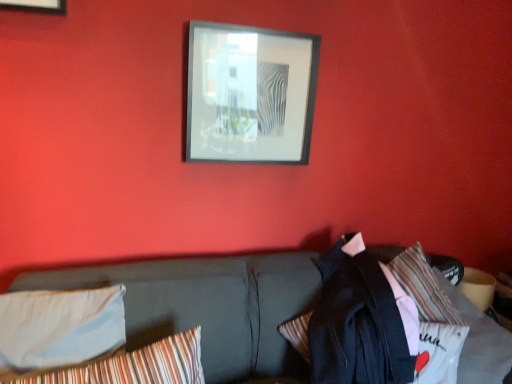
Question: From the image's perspective, would you say striped fabric pillow at lower left, placed as the second pillow when sorted from left to right, is shown under dark gray fabric couch at center?

Choices:
 (A) yes
 (B) no

Answer: (B)

Question: Is striped fabric pillow at lower left, placed as the second pillow when sorted from left to right, to the left of dark gray fabric couch at center from the viewer's perspective?

Choices:
 (A) no
 (B) yes

Answer: (B)

Question: From a real-world perspective, is striped fabric pillow at lower left, placed as the second pillow when sorted from left to right, over dark gray fabric couch at center?

Choices:
 (A) no
 (B) yes

Answer: (B)

Question: Are striped fabric pillow at lower left, placed as the second pillow when sorted from left to right, and dark gray fabric couch at center making contact?

Choices:
 (A) yes
 (B) no

Answer: (B)

Question: Does striped fabric pillow at lower left, the 1th pillow positioned from the right, have a greater height compared to dark gray fabric couch at center?

Choices:
 (A) yes
 (B) no

Answer: (B)

Question: Is dark gray fabric couch at center inside striped fabric pillow at lower left, placed as the second pillow when sorted from left to right?

Choices:
 (A) yes
 (B) no

Answer: (B)

Question: Considering the relative sizes of dark blue fabric jacket at lower right and dark gray fabric couch at center in the image provided, is dark blue fabric jacket at lower right shorter than dark gray fabric couch at center?

Choices:
 (A) yes
 (B) no

Answer: (A)

Question: Does dark blue fabric jacket at lower right have a larger size compared to dark gray fabric couch at center?

Choices:
 (A) yes
 (B) no

Answer: (B)

Question: Does dark blue fabric jacket at lower right appear on the left side of dark gray fabric couch at center?

Choices:
 (A) no
 (B) yes

Answer: (A)

Question: Is dark blue fabric jacket at lower right not inside dark gray fabric couch at center?

Choices:
 (A) no
 (B) yes

Answer: (A)

Question: Does dark blue fabric jacket at lower right have a smaller size compared to dark gray fabric couch at center?

Choices:
 (A) yes
 (B) no

Answer: (A)

Question: Does dark blue fabric jacket at lower right appear on the right side of dark gray fabric couch at center?

Choices:
 (A) no
 (B) yes

Answer: (B)

Question: From the image's perspective, is dark gray fabric couch at center under black matte picture frame at upper center?

Choices:
 (A) yes
 (B) no

Answer: (A)